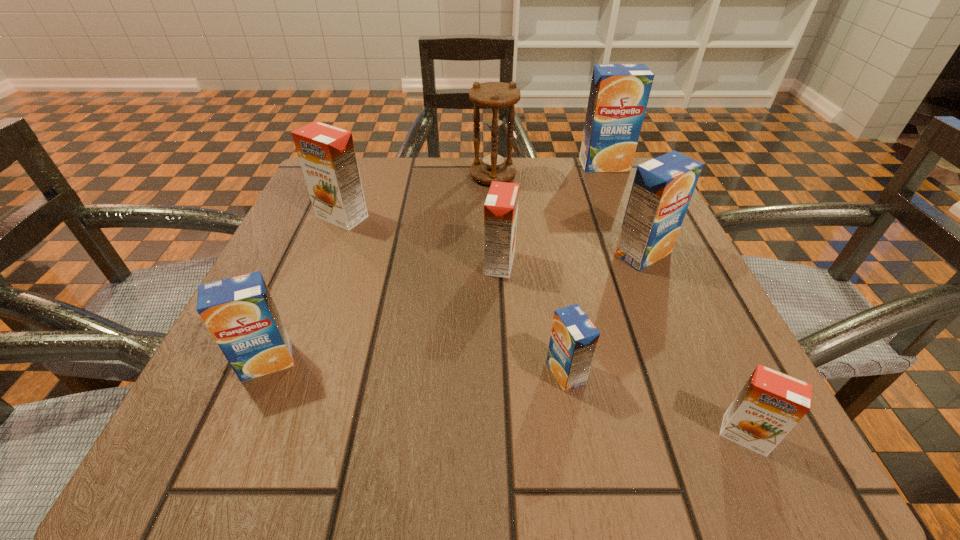
Find the location of a particular element. The image size is (960, 540). free point between the nearest orange juice and the tallest orange juice is located at coordinates (674, 300).

The height and width of the screenshot is (540, 960). I want to click on empty space between the smallest blue orange_juice and the third smallest blue orange_juice, so tap(604, 313).

What are the coordinates of `object that ranks as the seventh closest to the farthest orange juice` in the screenshot? It's located at (239, 312).

Locate which object ranks in proximity to the biggest blue orange_juice. Please provide its 2D coordinates. Your answer should be formatted as a tuple, i.e. [(x, y)], where the tuple contains the x and y coordinates of a point satisfying the conditions above.

[(494, 164)]

I want to click on orange juice that is the fourth closest to the third biggest blue orange_juice, so click(662, 189).

Identify the location of the sixth closest orange juice relative to the sixth nearest object. This screenshot has width=960, height=540. (769, 405).

I want to click on the second closest blue orange_juice to the second nearest orange orange juice, so click(x=662, y=189).

This screenshot has height=540, width=960. Identify the location of blue orange_juice that is the third closest one to the rightmost orange orange juice. (239, 312).

This screenshot has width=960, height=540. What are the coordinates of `orange orange juice that is the third closest to the smallest blue orange_juice` in the screenshot? It's located at (327, 155).

Select which orange orange juice appears as the second closest to the second farthest orange juice. Please provide its 2D coordinates. Your answer should be formatted as a tuple, i.e. [(x, y)], where the tuple contains the x and y coordinates of a point satisfying the conditions above.

[(769, 405)]